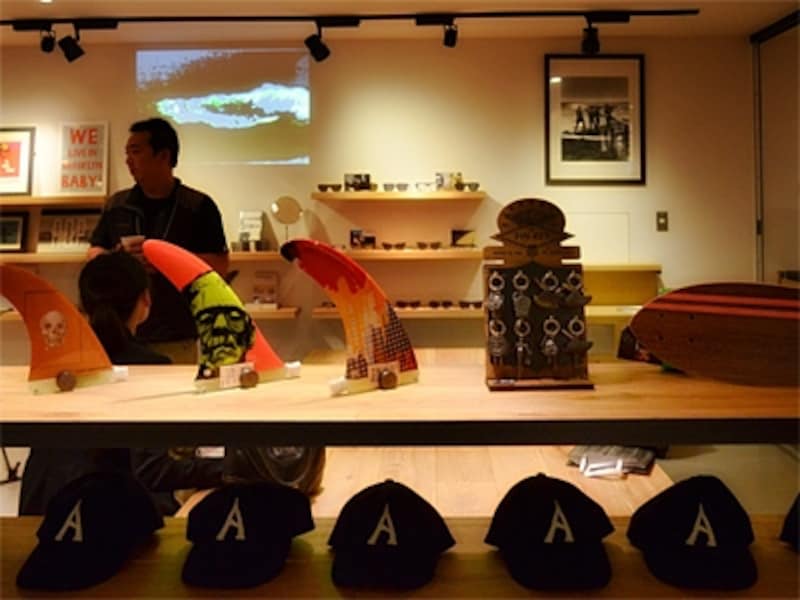
Locate an element on the screen. Image resolution: width=800 pixels, height=600 pixels. switch is located at coordinates (662, 222).